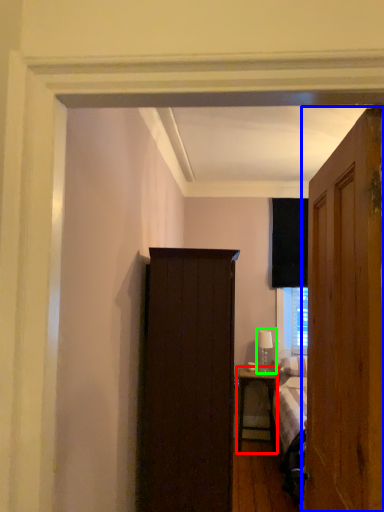
Question: Considering the real-world distances, which object is farthest from nightstand (highlighted by a red box)? door (highlighted by a blue box) or table lamp (highlighted by a green box)?

Choices:
 (A) door
 (B) table lamp

Answer: (A)